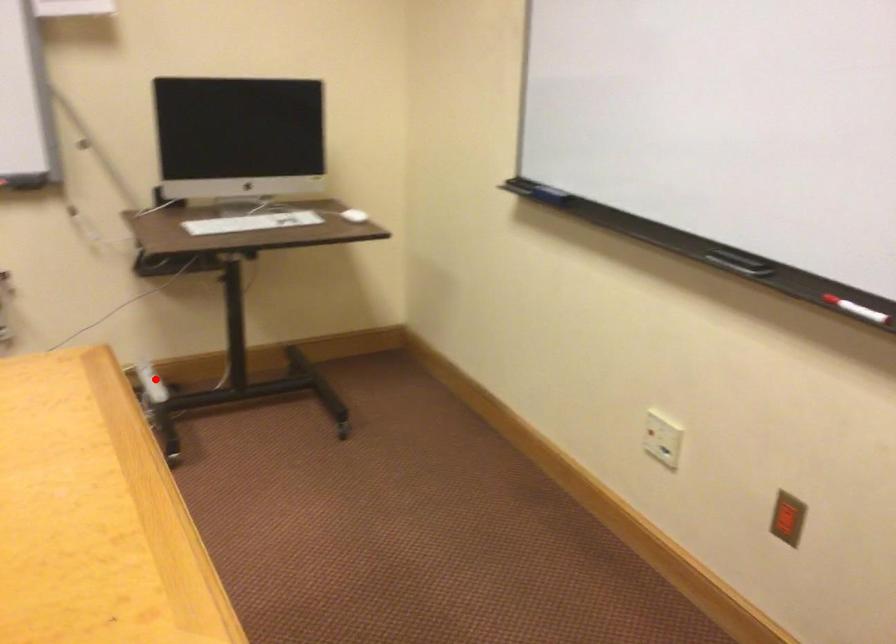
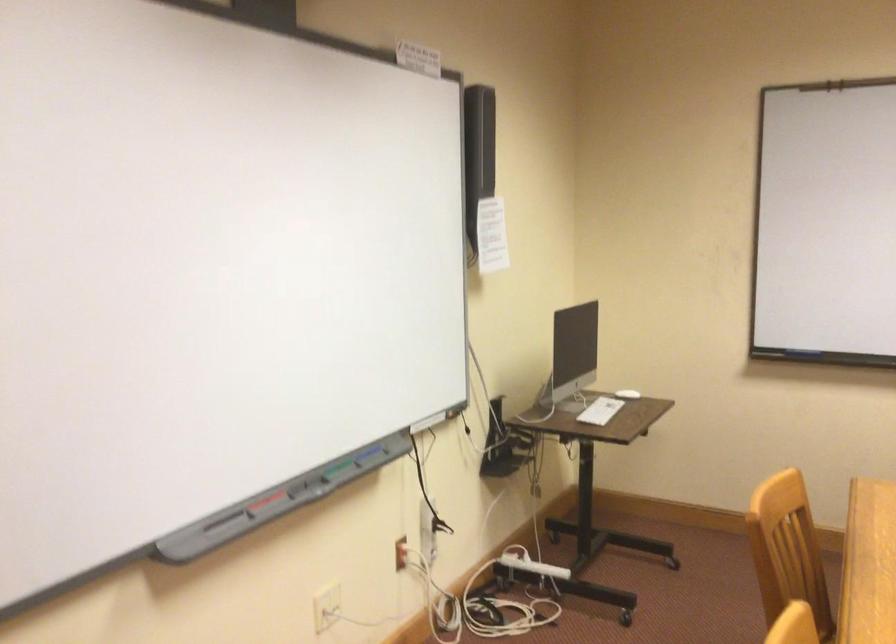
Find the pixel in the second image that matches the highlighted location in the first image.

(530, 564)